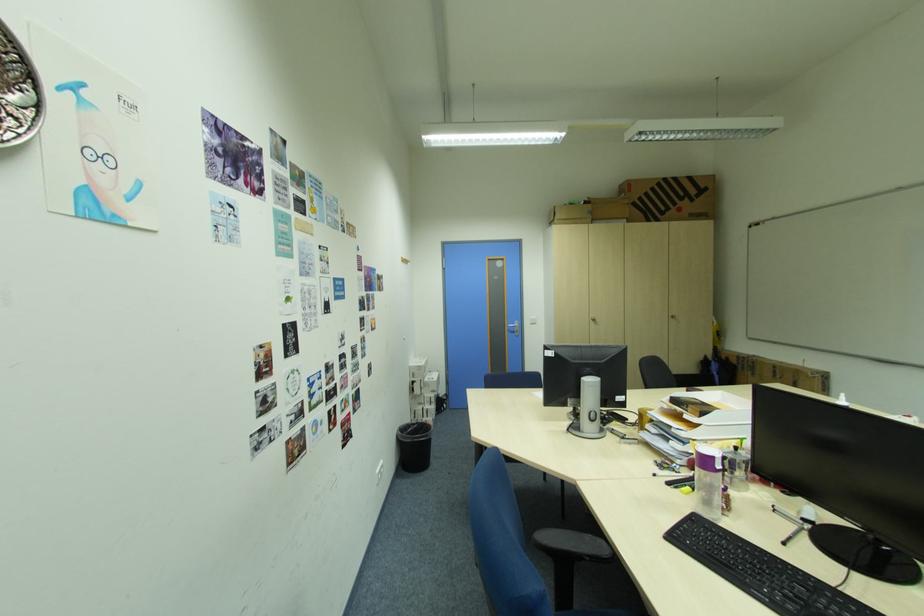
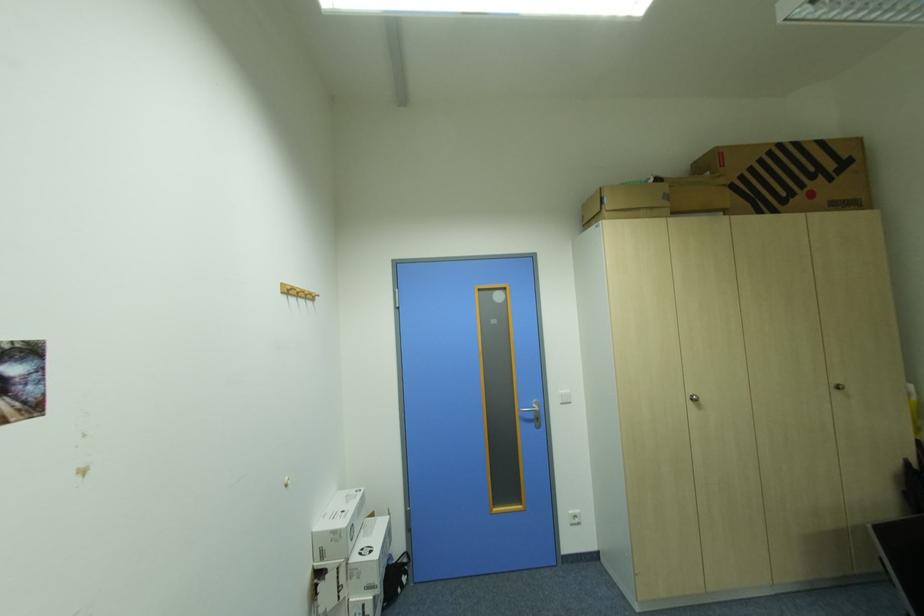
Where in the second image is the point corresponding to (599,320) from the first image?

(697, 399)